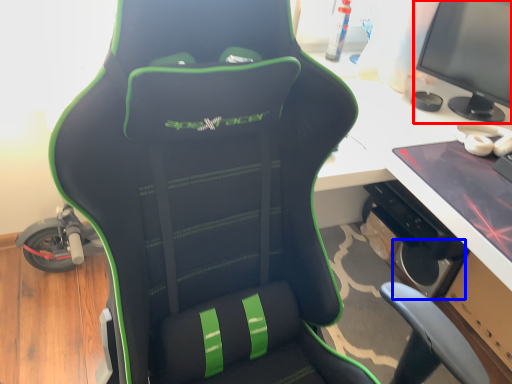
Question: Which of the following is the closest to the observer, computer monitor (highlighted by a red box) or speaker (highlighted by a blue box)?

Choices:
 (A) computer monitor
 (B) speaker

Answer: (A)